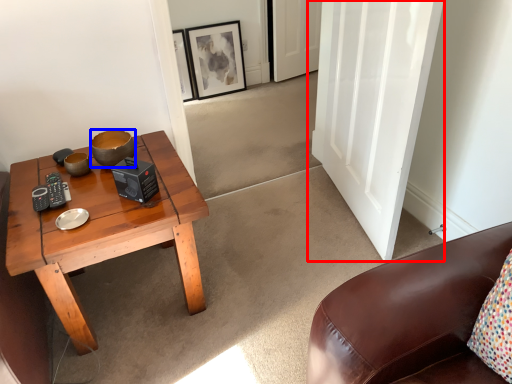
Question: Among these objects, which one is farthest to the camera, door (highlighted by a red box) or bowl (highlighted by a blue box)?

Choices:
 (A) door
 (B) bowl

Answer: (B)